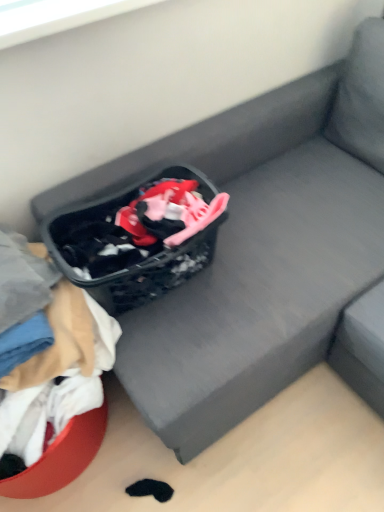
The height and width of the screenshot is (512, 384). What do you see at coordinates (59, 397) in the screenshot? I see `white cotton fabric at lower left` at bounding box center [59, 397].

Find the location of a particular element. white cotton fabric at lower left is located at coordinates (59, 397).

This screenshot has height=512, width=384. What do you see at coordinates (136, 239) in the screenshot?
I see `black fabric shopping basket at center` at bounding box center [136, 239].

At what (x,y) coordinates should I click in order to perform the action: click on black fabric shopping basket at center. Please return your answer as a coordinate pair (x, y). This screenshot has height=512, width=384. Looking at the image, I should click on (136, 239).

The image size is (384, 512). Find the location of `white cotton fabric at lower left`. white cotton fabric at lower left is located at coordinates (59, 397).

Which is more to the left, white cotton fabric at lower left or black fabric shopping basket at center?

Positioned to the left is white cotton fabric at lower left.

Is white cotton fabric at lower left in front of or behind black fabric shopping basket at center in the image?

white cotton fabric at lower left is in front of black fabric shopping basket at center.

Is point (84, 428) in front of point (140, 288)?

No, it is not.

From the image's perspective, is white cotton fabric at lower left above black fabric shopping basket at center?

No, from the image's perspective, white cotton fabric at lower left is not over black fabric shopping basket at center.

From a real-world perspective, between white cotton fabric at lower left and black fabric shopping basket at center, who is vertically higher?

In real-world perspective, black fabric shopping basket at center is above.

From the picture: Considering the relative sizes of white cotton fabric at lower left and black fabric shopping basket at center in the image provided, is white cotton fabric at lower left wider than black fabric shopping basket at center?

Yes, white cotton fabric at lower left is wider than black fabric shopping basket at center.

Between white cotton fabric at lower left and black fabric shopping basket at center, which one has more height?

white cotton fabric at lower left.

Which of these two, white cotton fabric at lower left or black fabric shopping basket at center, is bigger?

Bigger between the two is white cotton fabric at lower left.

Is white cotton fabric at lower left inside the boundaries of black fabric shopping basket at center, or outside?

white cotton fabric at lower left cannot be found inside black fabric shopping basket at center.

Is white cotton fabric at lower left placed right next to black fabric shopping basket at center?

No, white cotton fabric at lower left is not in contact with black fabric shopping basket at center.

Is white cotton fabric at lower left aimed at black fabric shopping basket at center?

No, white cotton fabric at lower left does not turn towards black fabric shopping basket at center.

How different are the orientations of white cotton fabric at lower left and black fabric shopping basket at center in degrees?

4.61 degrees.

How far apart are white cotton fabric at lower left and black fabric shopping basket at center?

white cotton fabric at lower left is 9.54 inches from black fabric shopping basket at center.

In order to click on shopping basket above the white cotton fabric at lower left (from the image's perspective) in this screenshot , I will do `click(136, 239)`.

Considering the relative positions of black fabric shopping basket at center and white cotton fabric at lower left in the image provided, is black fabric shopping basket at center to the right of white cotton fabric at lower left from the viewer's perspective?

Yes.

Who is more distant, black fabric shopping basket at center or white cotton fabric at lower left?

black fabric shopping basket at center is behind.

Which is nearer, (65, 229) or (6, 481)?

The point (6, 481) is in front.

From the image's perspective, does black fabric shopping basket at center appear higher than white cotton fabric at lower left?

Yes.

From a real-world perspective, which object rests below the other?

white cotton fabric at lower left.

Consider the image. Which object is wider, black fabric shopping basket at center or white cotton fabric at lower left?

white cotton fabric at lower left.

Is black fabric shopping basket at center taller than white cotton fabric at lower left?

In fact, black fabric shopping basket at center may be shorter than white cotton fabric at lower left.

Which of these two, black fabric shopping basket at center or white cotton fabric at lower left, is smaller?

black fabric shopping basket at center is smaller.

Is black fabric shopping basket at center inside or outside of white cotton fabric at lower left?

black fabric shopping basket at center is not inside white cotton fabric at lower left, it's outside.

Is black fabric shopping basket at center next to white cotton fabric at lower left and touching it?

No, black fabric shopping basket at center is not making contact with white cotton fabric at lower left.

Is white cotton fabric at lower left at the back of black fabric shopping basket at center?

No.

Locate an element on the screen. The height and width of the screenshot is (512, 384). shopping basket above the white cotton fabric at lower left (from a real-world perspective) is located at coordinates (136, 239).

This screenshot has width=384, height=512. Identify the location of shopping basket above the white cotton fabric at lower left (from the image's perspective). (136, 239).

Where is `clothing that is under the black fabric shopping basket at center (from a real-world perspective)`? Image resolution: width=384 pixels, height=512 pixels. clothing that is under the black fabric shopping basket at center (from a real-world perspective) is located at coordinates (59, 397).